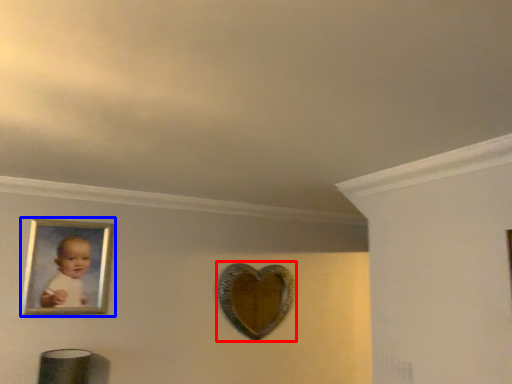
Question: Which object is closer to the camera taking this photo, mirror (highlighted by a red box) or picture frame (highlighted by a blue box)?

Choices:
 (A) mirror
 (B) picture frame

Answer: (B)